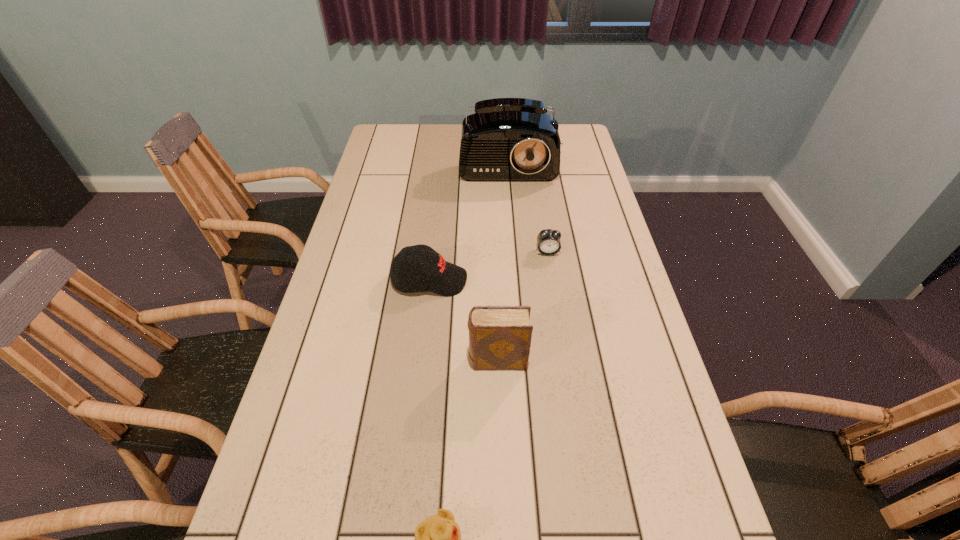
Where is `vacant space at the far left corner of the desktop`? The height and width of the screenshot is (540, 960). vacant space at the far left corner of the desktop is located at coordinates (402, 153).

Where is `free space between the second farthest object and the third tallest object`? This screenshot has width=960, height=540. free space between the second farthest object and the third tallest object is located at coordinates (489, 266).

At what (x,y) coordinates should I click in order to perform the action: click on free area in between the third nearest object and the fourth farthest object. Please return your answer as a coordinate pair (x, y). Looking at the image, I should click on (464, 320).

Locate an element on the screen. empty space between the tallest object and the third farthest object is located at coordinates (468, 218).

Identify the location of free space between the radio receiver and the third shortest object. (468, 218).

Locate an element on the screen. object that is the closest to the second farthest object is located at coordinates (429, 271).

I want to click on the fourth closest object to the diary, so click(507, 139).

At what (x,y) coordinates should I click in order to perform the action: click on free space that satisfies the following two spatial constraints: 1. on the front-facing side of the radio receiver; 2. on the front-facing side of the third farthest object. Please return your answer as a coordinate pair (x, y). The image size is (960, 540). Looking at the image, I should click on (517, 280).

Where is `blank area in the image that satisfies the following two spatial constraints: 1. on the front side of the fourth nearest object; 2. on the spine side of the diary`? This screenshot has height=540, width=960. blank area in the image that satisfies the following two spatial constraints: 1. on the front side of the fourth nearest object; 2. on the spine side of the diary is located at coordinates (564, 361).

Where is `vacant space that satisfies the following two spatial constraints: 1. on the front-facing side of the radio receiver; 2. on the front-facing side of the third tallest object`? vacant space that satisfies the following two spatial constraints: 1. on the front-facing side of the radio receiver; 2. on the front-facing side of the third tallest object is located at coordinates (517, 280).